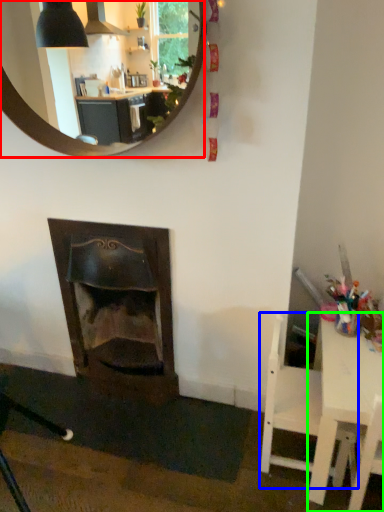
Question: Considering the real-world distances, which object is closest to mirror (highlighted by a red box)? chair (highlighted by a blue box) or table (highlighted by a green box).

Choices:
 (A) chair
 (B) table

Answer: (A)